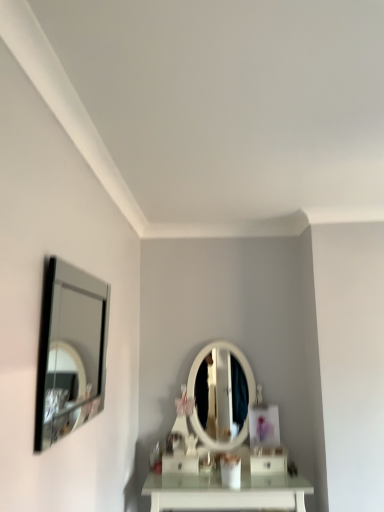
Where is `silver-framed mirror at left`? The height and width of the screenshot is (512, 384). silver-framed mirror at left is located at coordinates (75, 358).

Locate an element on the screen. This screenshot has width=384, height=512. white glossy drawer at lower center, acting as the 1th drawer starting from the right is located at coordinates (268, 464).

Where is `silver-framed mirror at left`? The width and height of the screenshot is (384, 512). silver-framed mirror at left is located at coordinates (75, 358).

Relative to white glossy drawer at lower center, acting as the 1th drawer starting from the right, is silver-framed mirror at left in front or behind?

silver-framed mirror at left is in front of white glossy drawer at lower center, acting as the 1th drawer starting from the right.

Which is nearer, (68, 336) or (268, 461)?

Point (68, 336).

Is silver-framed mirror at left with white glossy drawer at lower center, acting as the 1th drawer starting from the right?

No, silver-framed mirror at left is not with white glossy drawer at lower center, acting as the 1th drawer starting from the right.

Is white glossy drawer at center, arranged as the first drawer when viewed from the left, not inside silver-framed mirror at left?

Yes, white glossy drawer at center, arranged as the first drawer when viewed from the left, is outside of silver-framed mirror at left.

Does white glossy drawer at center, arranged as the first drawer when viewed from the left, have a greater width compared to silver-framed mirror at left?

Correct, the width of white glossy drawer at center, arranged as the first drawer when viewed from the left, exceeds that of silver-framed mirror at left.

Could you tell me if white glossy drawer at center, arranged as the first drawer when viewed from the left, is turned towards silver-framed mirror at left?

No, white glossy drawer at center, arranged as the first drawer when viewed from the left, is not aimed at silver-framed mirror at left.

Could you tell me if silver-framed mirror at left is turned towards white glossy drawer at center, arranged as the first drawer when viewed from the left?

No, silver-framed mirror at left does not turn towards white glossy drawer at center, arranged as the first drawer when viewed from the left.

From a real-world perspective, is silver-framed mirror at left located beneath white glossy drawer at center, arranged as the 2th drawer when viewed from the right?

No.

Which point is more distant from viewer, (66, 329) or (178, 459)?

The point (66, 329) is farther.

Measure the distance from silver-framed mirror at left to white glossy drawer at center, arranged as the 2th drawer when viewed from the right.

A distance of 34.93 inches exists between silver-framed mirror at left and white glossy drawer at center, arranged as the 2th drawer when viewed from the right.

Based on the photo, is white glossy drawer at lower center, which ranks as the second drawer in left-to-right order, spatially inside white glossy drawer at center, arranged as the first drawer when viewed from the left, or outside of it?

white glossy drawer at lower center, which ranks as the second drawer in left-to-right order, exists outside the volume of white glossy drawer at center, arranged as the first drawer when viewed from the left.

Where is `drawer located above the white glossy drawer at center, arranged as the 2th drawer when viewed from the right (from the image's perspective)`? The image size is (384, 512). drawer located above the white glossy drawer at center, arranged as the 2th drawer when viewed from the right (from the image's perspective) is located at coordinates (268, 464).

Is white glossy drawer at lower center, acting as the 1th drawer starting from the right, in front of white glossy drawer at center, arranged as the first drawer when viewed from the left?

Yes, it is.

Relative to white glossy drawer at lower center, which ranks as the second drawer in left-to-right order, is white glossy drawer at center, arranged as the 2th drawer when viewed from the right, in front or behind?

white glossy drawer at center, arranged as the 2th drawer when viewed from the right, is positioned farther from the viewer than white glossy drawer at lower center, which ranks as the second drawer in left-to-right order.

Is white glossy drawer at center, arranged as the 2th drawer when viewed from the right, completely or partially outside of white glossy drawer at lower center, which ranks as the second drawer in left-to-right order?

That's correct, white glossy drawer at center, arranged as the 2th drawer when viewed from the right, is outside of white glossy drawer at lower center, which ranks as the second drawer in left-to-right order.

From a real-world perspective, who is located lower, white glossy drawer at center, arranged as the first drawer when viewed from the left, or white glossy drawer at lower center, which ranks as the second drawer in left-to-right order?

white glossy drawer at lower center, which ranks as the second drawer in left-to-right order, is physically lower.

From the image's perspective, between white glossy drawer at center, arranged as the first drawer when viewed from the left, and white glossy drawer at lower center, acting as the 1th drawer starting from the right, which one is located above?

white glossy drawer at lower center, acting as the 1th drawer starting from the right.

There is a silver-framed mirror at left. Where is `the 2nd drawer below it (from a real-world perspective)`? the 2nd drawer below it (from a real-world perspective) is located at coordinates (268, 464).

From the image's perspective, between white glossy drawer at lower center, which ranks as the second drawer in left-to-right order, and silver-framed mirror at left, who is located below?

white glossy drawer at lower center, which ranks as the second drawer in left-to-right order.

Which drawer is the 2nd one when counting from the right side of the silver-framed mirror at left? Please provide its 2D coordinates.

[(268, 464)]

From a real-world perspective, count 1st drawers downward from the silver-framed mirror at left and point to it. Please provide its 2D coordinates.

[(180, 463)]

Estimate the real-world distances between objects in this image. Which object is closer to silver-framed mirror at left, white glossy drawer at center, arranged as the first drawer when viewed from the left, or white glossy drawer at lower center, which ranks as the second drawer in left-to-right order?

white glossy drawer at center, arranged as the first drawer when viewed from the left, lies closer to silver-framed mirror at left than the other object.

Consider the image. Looking at the image, which one is located further to white glossy drawer at lower center, acting as the 1th drawer starting from the right, silver-framed mirror at left or white glossy drawer at center, arranged as the 2th drawer when viewed from the right?

silver-framed mirror at left lies further to white glossy drawer at lower center, acting as the 1th drawer starting from the right, than the other object.

Based on their spatial positions, is white glossy drawer at center, arranged as the first drawer when viewed from the left, or silver-framed mirror at left closer to white glossy drawer at lower center, acting as the 1th drawer starting from the right?

white glossy drawer at center, arranged as the first drawer when viewed from the left, is positioned closer to the anchor white glossy drawer at lower center, acting as the 1th drawer starting from the right.

Estimate the real-world distances between objects in this image. Which object is closer to white glossy drawer at center, arranged as the first drawer when viewed from the left, silver-framed mirror at left or white glossy drawer at lower center, acting as the 1th drawer starting from the right?

white glossy drawer at lower center, acting as the 1th drawer starting from the right.

Estimate the real-world distances between objects in this image. Which object is further from white glossy drawer at center, arranged as the first drawer when viewed from the left, white glossy drawer at lower center, acting as the 1th drawer starting from the right, or silver-framed mirror at left?

silver-framed mirror at left is positioned further to the anchor white glossy drawer at center, arranged as the first drawer when viewed from the left.

Considering their positions, is white glossy drawer at lower center, acting as the 1th drawer starting from the right, positioned further to silver-framed mirror at left than white glossy drawer at center, arranged as the first drawer when viewed from the left?

white glossy drawer at lower center, acting as the 1th drawer starting from the right.

The height and width of the screenshot is (512, 384). What are the coordinates of `drawer positioned between silver-framed mirror at left and white glossy drawer at center, arranged as the 2th drawer when viewed from the right, from near to far` in the screenshot? It's located at (268, 464).